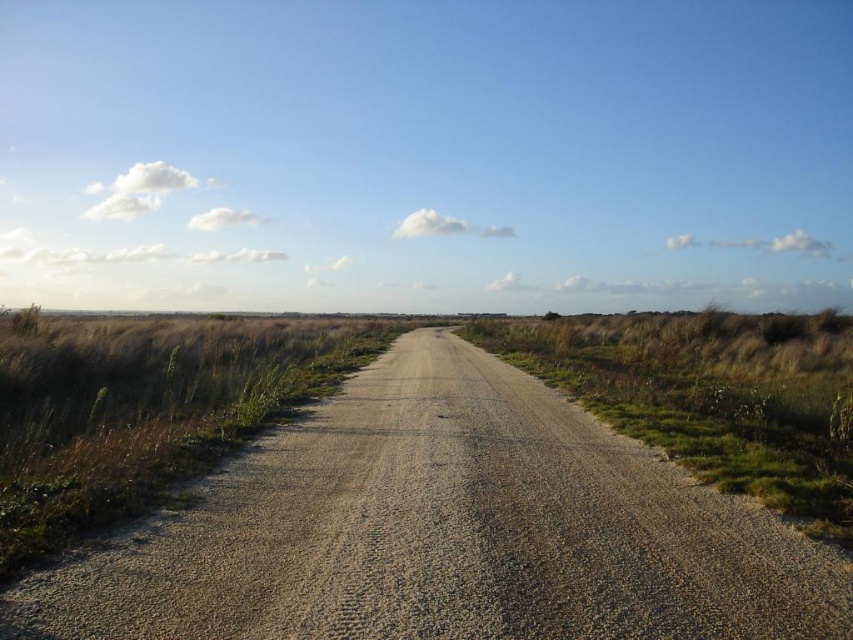
Who is lower down, brown gravel road at center or green grass at right?

brown gravel road at center is lower down.

Can you confirm if brown gravel road at center is shorter than green grass at right?

Yes.

The width and height of the screenshot is (853, 640). I want to click on brown gravel road at center, so (x=445, y=531).